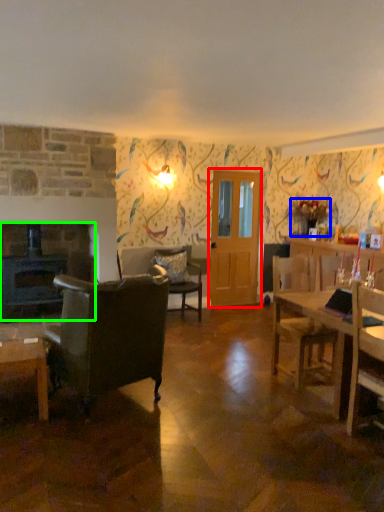
Question: Which is farther away from glass door (highlighted by a red box)? houseplant (highlighted by a blue box) or fireplace (highlighted by a green box)?

Choices:
 (A) houseplant
 (B) fireplace

Answer: (B)